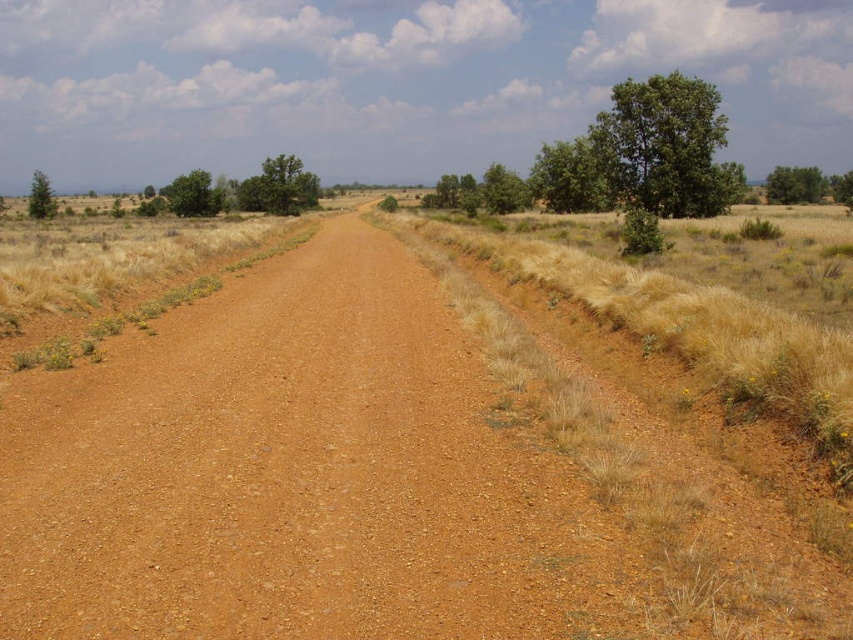
You are a hiker trying to navigate the dirt road. You see the green leafy tree at upper right and the green matte tree at left. Which tree is located to the right side of the other?

The green leafy tree at upper right is positioned on the right side of the green matte tree at left.

You are driving a large truck that is 3 meters wide. You need to pass through the narrowest part of the road between the green leafy tree at upper right and the green matte tree at left. Can your truck fit through the gap between them?

The green leafy tree at upper right is positioned over the green matte tree at left, which means the gap between them is narrow enough that the truck may not fit. However, since the description only mentions their vertical positioning and not the horizontal distance, it is unclear if the 3 meter width of the truck can pass. More information about the horizontal spacing between the trees is needed to determine if the truck can fit through the gap.

You are driving a car and want to park between the green leafy tree at upper right and the green matte tree at left. Which tree should you back up to so that your car is closer to the smaller tree?

You should back up to the green leafy tree at upper right because it is smaller than the green matte tree at left, so positioning your car near it ensures you are closer to the smaller tree.